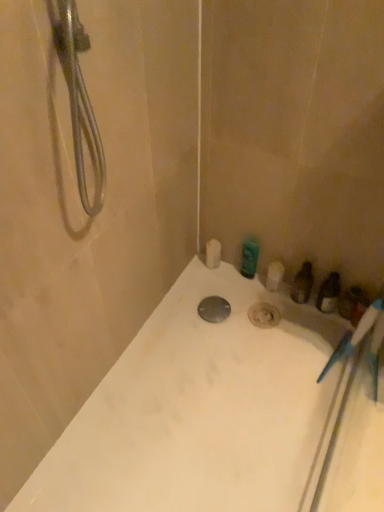
Locate an element on the screen. unoccupied space behind metallic silver drain at center is located at coordinates (215, 289).